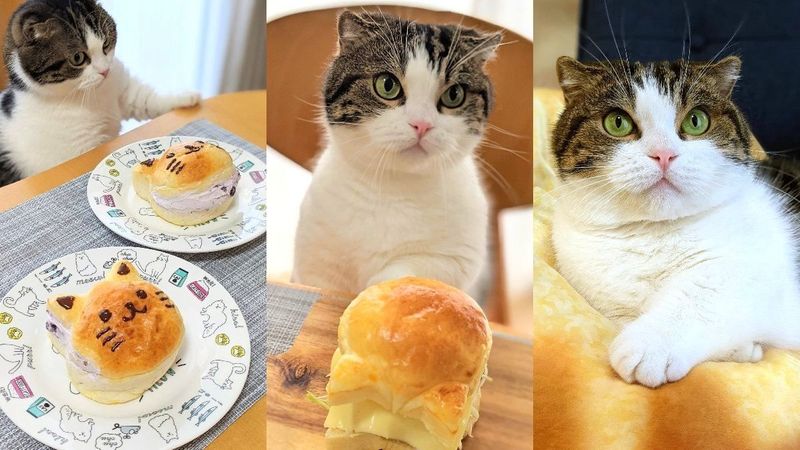
Where is `chair`? The width and height of the screenshot is (800, 450). chair is located at coordinates (517, 122), (21, 14).